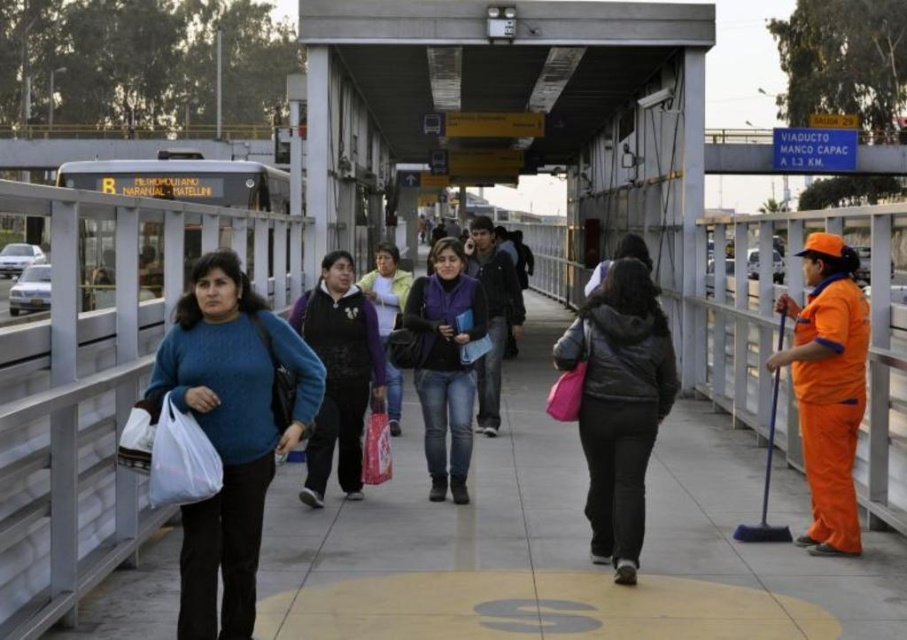
You are a photographer trying to capture a candid shot of the two people wearing the dark gray matte jacket at center and the matte black jacket at center. Since you want to ensure both are fully visible in the frame, which jacket wearer do you need to position closer to the camera to maintain their full visibility?

The dark gray matte jacket at center has a smaller width than the matte black jacket at center. To ensure both are fully visible, position the person in the dark gray matte jacket at center closer to the camera since their jacket is narrower, requiring less space in the frame compared to the wider matte black jacket at center.

You are standing at point (356,413) and want to walk to the bus stop labeled R. The bus stop is located at point (584,406). Which direction should you walk to reach the bus stop?

Point (584,406) is in front of point (356,413), so you should walk forward to reach the bus stop.

You are standing on the pedestrian bridge and want to move from point A to point B. Given that point A is at coordinates point (832, 428) and point B is at coordinates point (376, 371), which direction should you walk to get closer to point B?

To move from point A at coordinates point (832, 428) to point B at coordinates point (376, 371), you should walk away from the viewer since point B is further away than point A.